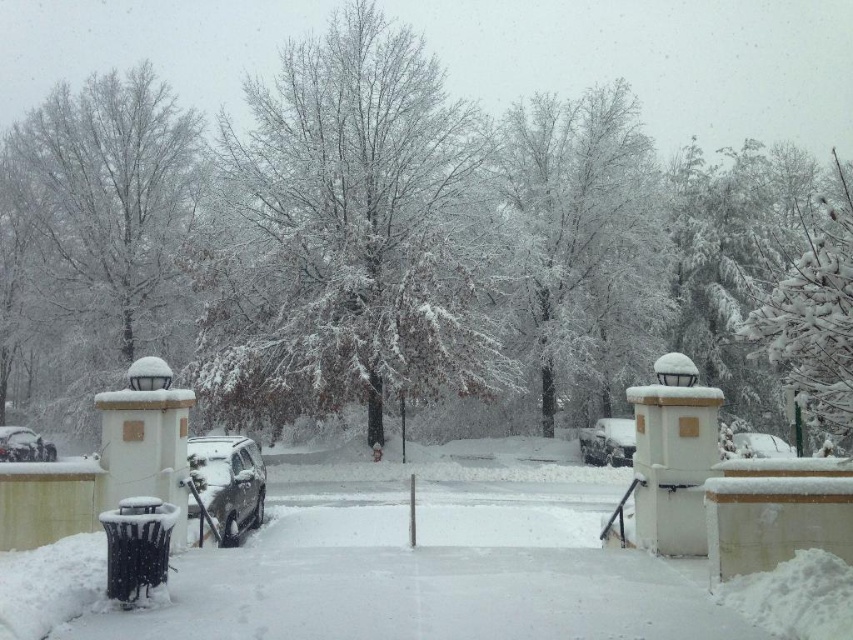
Does snow-covered tree at left come behind sleek silver car at center?

Yes, snow-covered tree at left is behind sleek silver car at center.

Can you confirm if snow-covered tree at left is positioned above sleek silver car at center?

Yes.

What are the coordinates of `snow-covered tree at left` in the screenshot? It's located at (99, 232).

Which is below, snow-covered tree at center or sleek silver sedan at center?

sleek silver sedan at center is below.

Is point (345, 260) farther from camera compared to point (630, 428)?

No, (345, 260) is in front of (630, 428).

I want to click on snow-covered tree at center, so [x=352, y=236].

Does snow-covered branches at center appear under sleek silver car at center?

No.

Does snow-covered branches at center appear over sleek silver car at center?

Yes.

What do you see at coordinates (583, 236) in the screenshot?
I see `snow-covered branches at center` at bounding box center [583, 236].

Identify the location of snow-covered branches at center. The width and height of the screenshot is (853, 640). (583, 236).